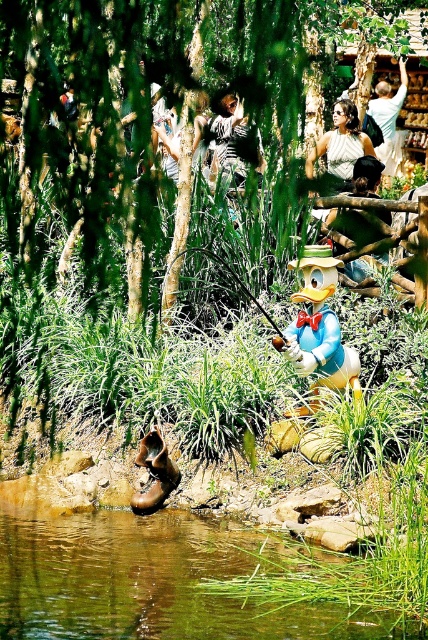
You are standing in the theme park scene with the Donald Duck statue. You want to place a new bench exactly at the point marked by coordinates point (296, 300). If the bench is 6 feet long, will it fit without overlapping any existing objects in the scene?

The point (296, 300) is 45.01 feet away from the viewer. Since the bench is only 6 feet long, it can be placed at that point without overlapping existing objects as there is sufficient space available at that distance.

You are a maintenance worker in the theme park and need to place a new sign next to the Donald Duck statue. The sign must be placed between the matte yellow duck at center and the smooth brown hat at center. Since the sign is 1.2 meters wide, will it fit in the space between them?

The matte yellow duck at center is wider than the smooth brown hat at center. The space between them is determined by their widths. Since the duck is wider, the distance between them might be sufficient, but the exact width difference isn